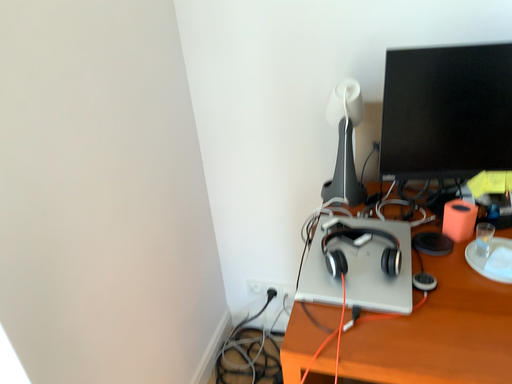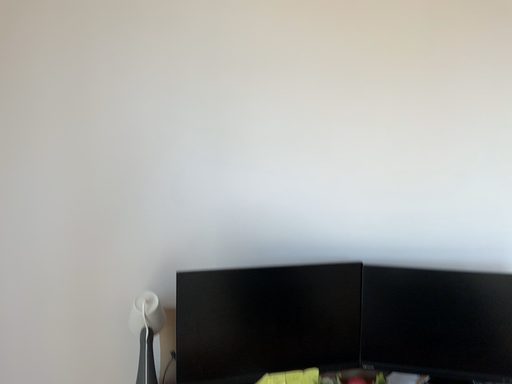
Question: Which way did the camera rotate in the video?

Choices:
 (A) rotated left
 (B) rotated right

Answer: (B)